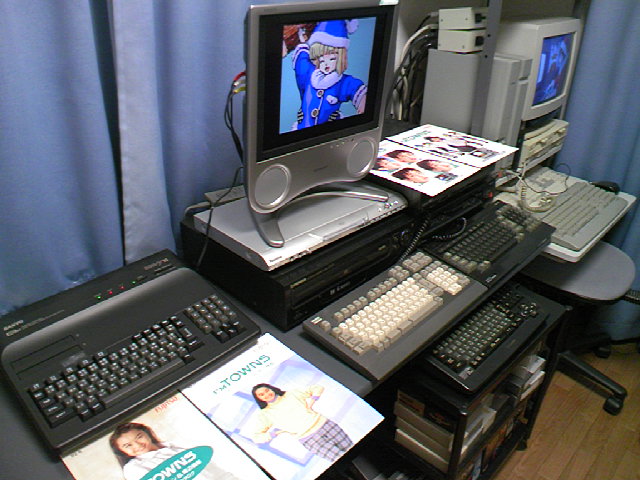
The width and height of the screenshot is (640, 480). Identify the location of typewriter. (141, 361).